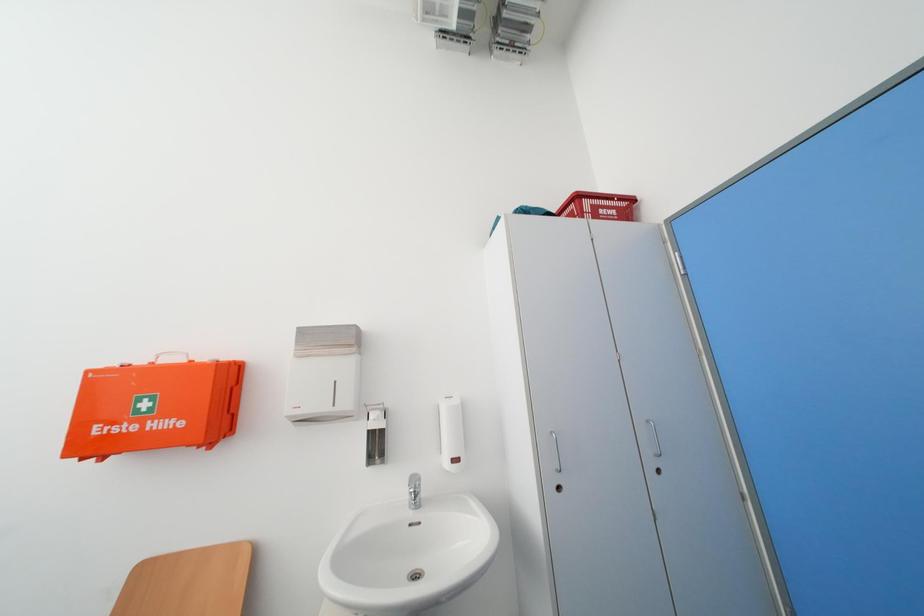
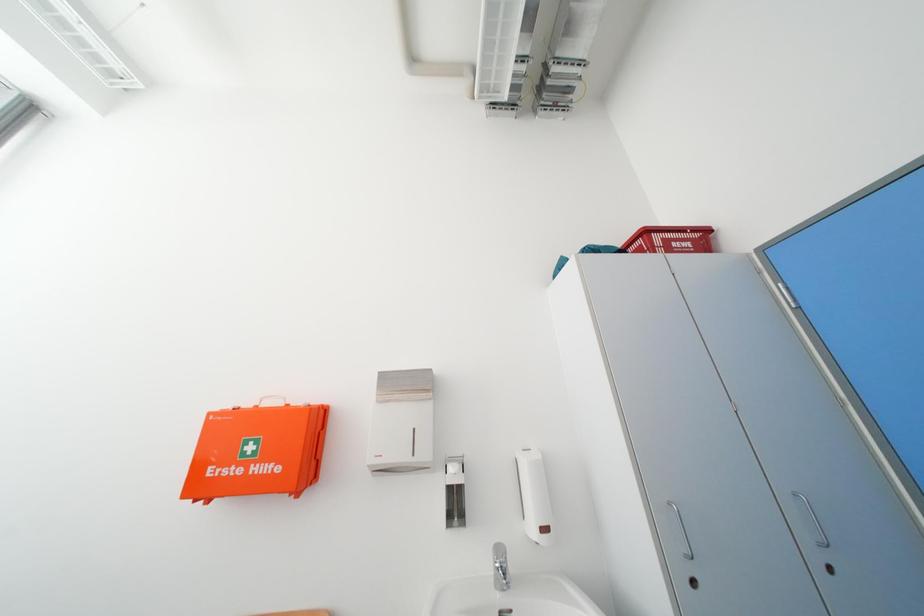
Question: The images are taken continuously from a first-person perspective. In which direction is your viewpoint rotating?

Choices:
 (A) Left
 (B) Right
 (C) Up
 (D) Down

Answer: (C)